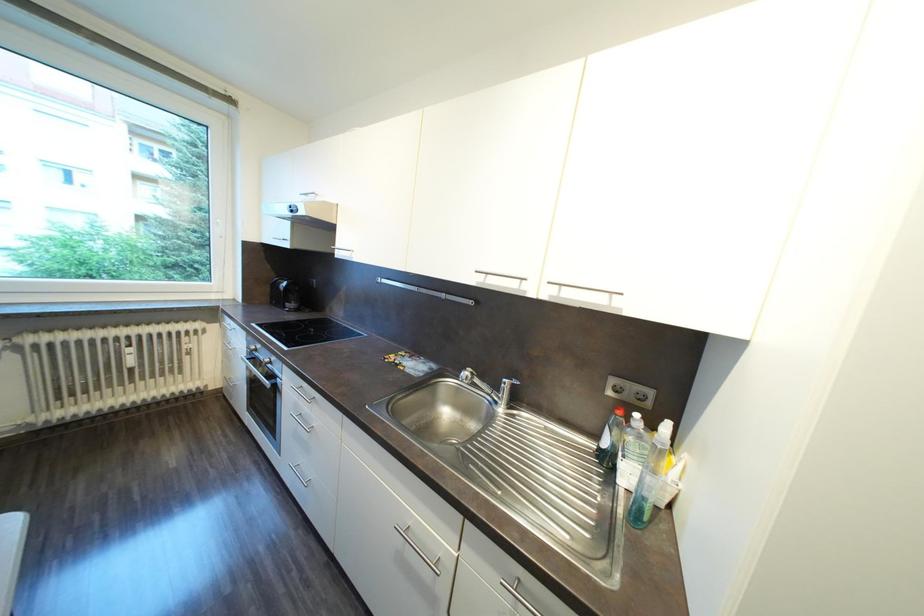
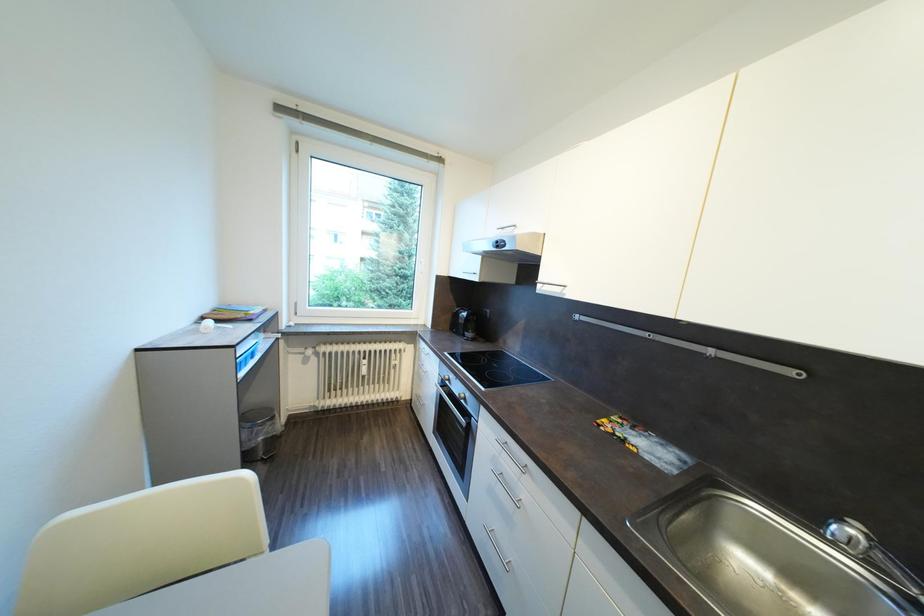
Question: The camera is either moving clockwise (left) or counter-clockwise (right) around the object. The first image is from the beginning of the video and the second image is from the end. Is the camera moving left or right when shooting the video?

Choices:
 (A) Left
 (B) Right

Answer: (B)